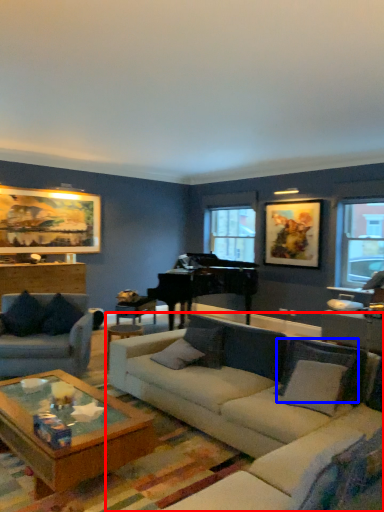
Question: Which object is further to the camera taking this photo, studio couch (highlighted by a red box) or pillow (highlighted by a blue box)?

Choices:
 (A) studio couch
 (B) pillow

Answer: (B)